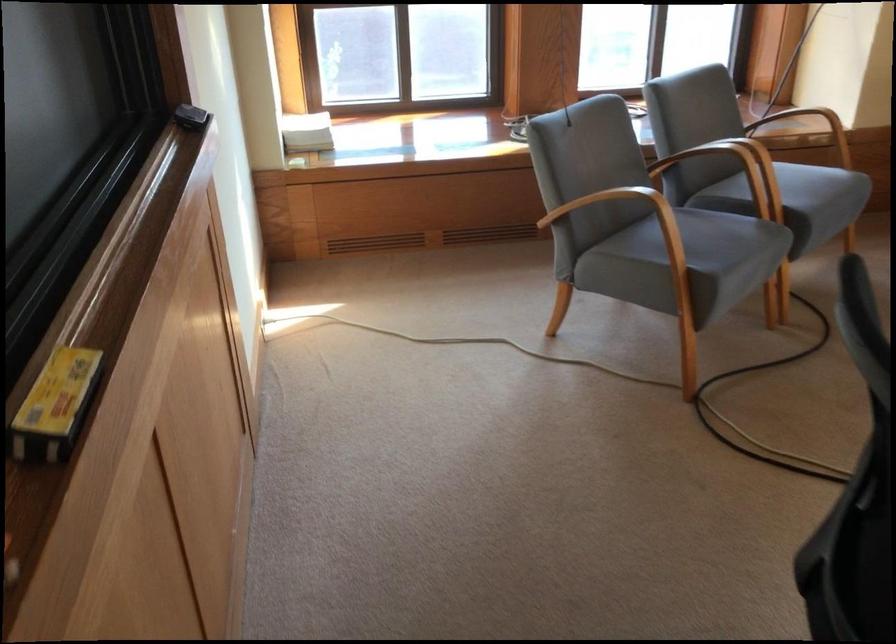
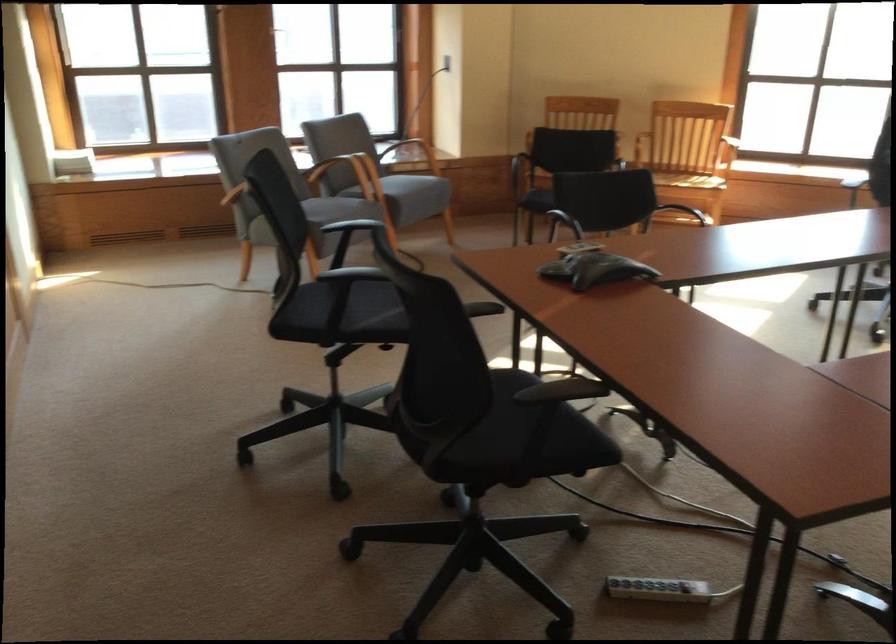
In the second image, find the point that corresponds to [825,222] in the first image.

(410, 194)